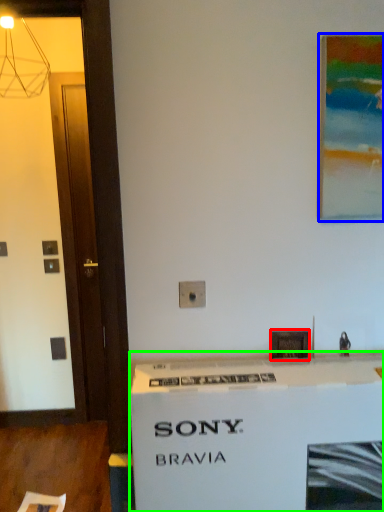
Question: Considering the real-world distances, which object is farthest from picture frame (highlighted by a red box)? picture frame (highlighted by a blue box) or counter (highlighted by a green box)?

Choices:
 (A) picture frame
 (B) counter

Answer: (A)